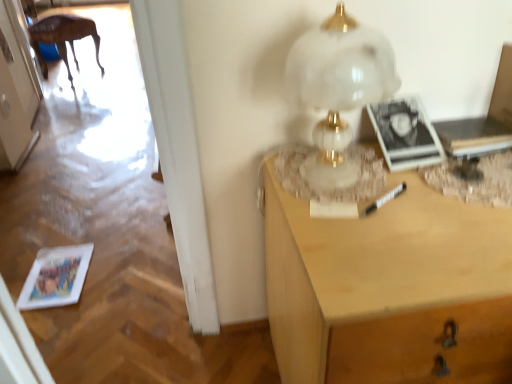
Question: Is white glossy door at upper left not close to light wood desk at right?

Choices:
 (A) yes
 (B) no

Answer: (A)

Question: Is white glossy door at upper left in contact with light wood desk at right?

Choices:
 (A) no
 (B) yes

Answer: (A)

Question: From a real-world perspective, is white glossy door at upper left beneath light wood desk at right?

Choices:
 (A) no
 (B) yes

Answer: (A)

Question: From the image's perspective, is white glossy door at upper left below light wood desk at right?

Choices:
 (A) yes
 (B) no

Answer: (B)

Question: Considering the relative sizes of white glossy door at upper left and light wood desk at right in the image provided, is white glossy door at upper left thinner than light wood desk at right?

Choices:
 (A) no
 (B) yes

Answer: (B)

Question: Is white glossy door at upper left bigger than light wood desk at right?

Choices:
 (A) yes
 (B) no

Answer: (B)

Question: Does white glossy door at upper left have a smaller size compared to white marble table lamp at upper right?

Choices:
 (A) yes
 (B) no

Answer: (B)

Question: From a real-world perspective, is white glossy door at upper left located beneath white marble table lamp at upper right?

Choices:
 (A) no
 (B) yes

Answer: (B)

Question: Does white glossy door at upper left appear on the left side of white marble table lamp at upper right?

Choices:
 (A) no
 (B) yes

Answer: (B)

Question: Can you confirm if white glossy door at upper left is shorter than white marble table lamp at upper right?

Choices:
 (A) no
 (B) yes

Answer: (A)

Question: Considering the relative sizes of white glossy door at upper left and white marble table lamp at upper right in the image provided, is white glossy door at upper left taller than white marble table lamp at upper right?

Choices:
 (A) yes
 (B) no

Answer: (A)

Question: From the image's perspective, is white glossy door at upper left below white marble table lamp at upper right?

Choices:
 (A) no
 (B) yes

Answer: (A)

Question: Can you confirm if white glossy door at upper left is smaller than wooden table at left?

Choices:
 (A) yes
 (B) no

Answer: (A)